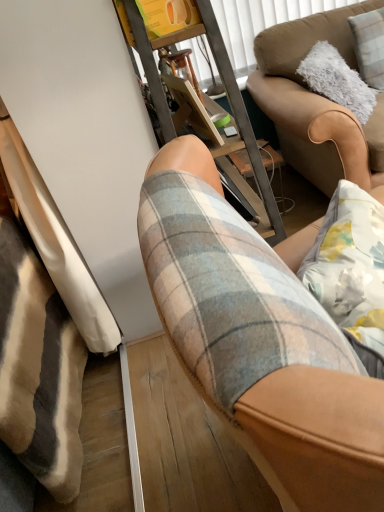
Question: Is fluffy white pillow at upper right touching metal frame at center?

Choices:
 (A) yes
 (B) no

Answer: (B)

Question: Can you confirm if fluffy white pillow at upper right is taller than metal frame at center?

Choices:
 (A) no
 (B) yes

Answer: (A)

Question: Is fluffy white pillow at upper right not within metal frame at center?

Choices:
 (A) no
 (B) yes

Answer: (B)

Question: Does fluffy white pillow at upper right have a greater width compared to metal frame at center?

Choices:
 (A) no
 (B) yes

Answer: (A)

Question: From the image's perspective, is fluffy white pillow at upper right over metal frame at center?

Choices:
 (A) no
 (B) yes

Answer: (B)

Question: Considering the relative sizes of fluffy white pillow at upper right and metal frame at center in the image provided, is fluffy white pillow at upper right bigger than metal frame at center?

Choices:
 (A) yes
 (B) no

Answer: (B)

Question: Considering the relative sizes of fluffy white pillow at upper right and brown leather couch at upper right in the image provided, is fluffy white pillow at upper right taller than brown leather couch at upper right?

Choices:
 (A) yes
 (B) no

Answer: (B)

Question: Does fluffy white pillow at upper right have a larger size compared to brown leather couch at upper right?

Choices:
 (A) yes
 (B) no

Answer: (B)

Question: From the image's perspective, does fluffy white pillow at upper right appear higher than brown leather couch at upper right?

Choices:
 (A) no
 (B) yes

Answer: (B)

Question: Is fluffy white pillow at upper right turned away from brown leather couch at upper right?

Choices:
 (A) yes
 (B) no

Answer: (A)

Question: From the image's perspective, does fluffy white pillow at upper right appear lower than brown leather couch at upper right?

Choices:
 (A) no
 (B) yes

Answer: (A)

Question: Is fluffy white pillow at upper right closer to camera compared to brown leather couch at upper right?

Choices:
 (A) yes
 (B) no

Answer: (B)

Question: Is plaid fabric shorts at center aimed at metal frame at center?

Choices:
 (A) no
 (B) yes

Answer: (A)